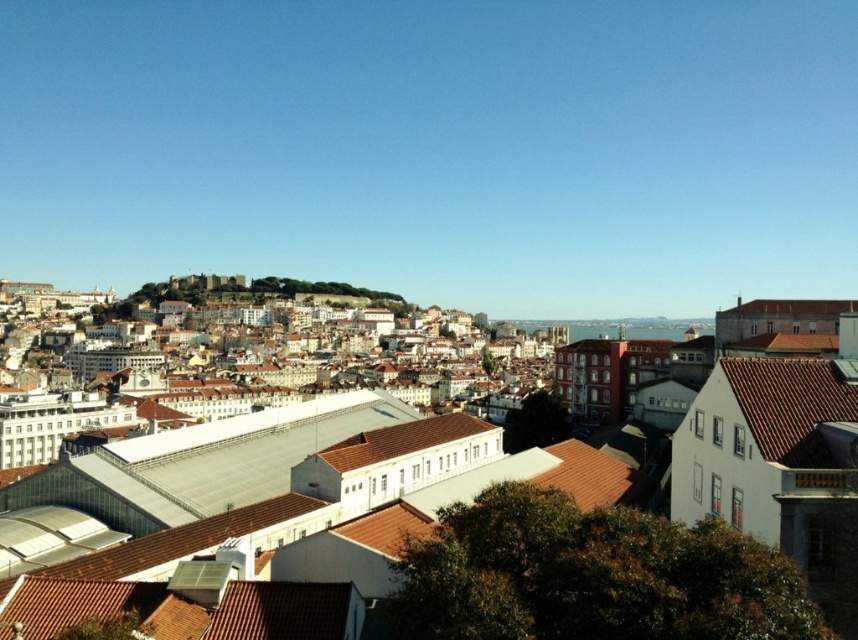
What does the point at coordinate (754,522) represent in the image?

The point at coordinate (754,522) represents brown tiled roofs at center.

You are an architect analyzing the rooftop patterns in the city. Which of the two roofs, the brown tiled roofs at center or the brown tile roof at right, would require more materials for a potential renovation project?

The brown tiled roofs at center requires more materials for renovation since it is larger in size than the brown tile roof at right.

In the scene shown: You are a drone operator who needs to fly a drone from the brown tiled roofs at center to a destination 50 meters away. Based on the scene, is there enough space between the buildings for the drone to fly straight without hitting any structures?

The brown tiled roofs at center are 49.08 meters apart. Since the required distance is 50 meters, the drone cannot fly straight to the destination without adjusting its path as the available space is slightly shorter.